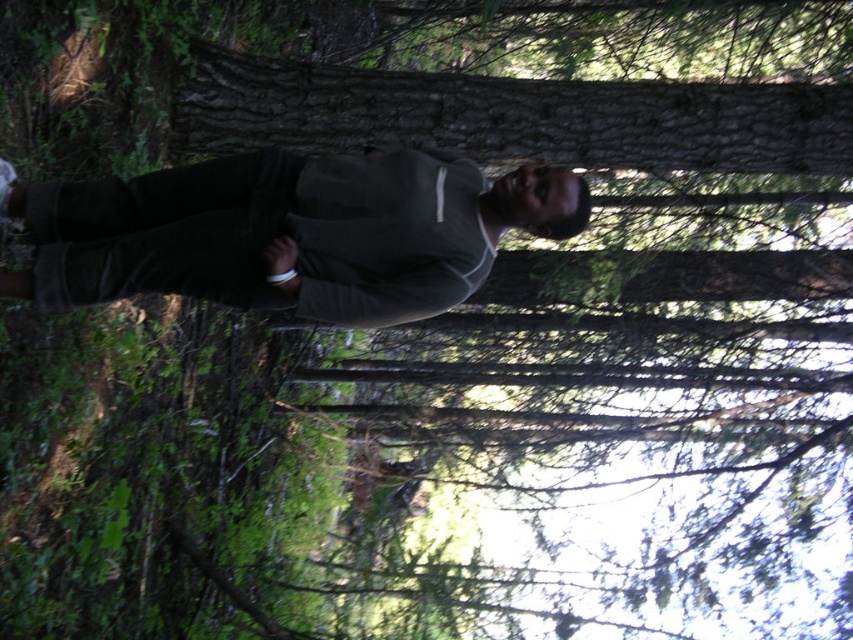
Question: Which point appears closest to the camera in this image?

Choices:
 (A) (509, 193)
 (B) (677, 129)

Answer: (A)

Question: From the image, what is the correct spatial relationship of gray matte sweater at center in relation to smooth brown bark at center?

Choices:
 (A) right
 (B) left

Answer: (B)

Question: Does gray matte sweater at center appear on the left side of smooth brown bark at center?

Choices:
 (A) yes
 (B) no

Answer: (A)

Question: Does gray matte sweater at center appear on the left side of smooth brown bark at center?

Choices:
 (A) yes
 (B) no

Answer: (A)